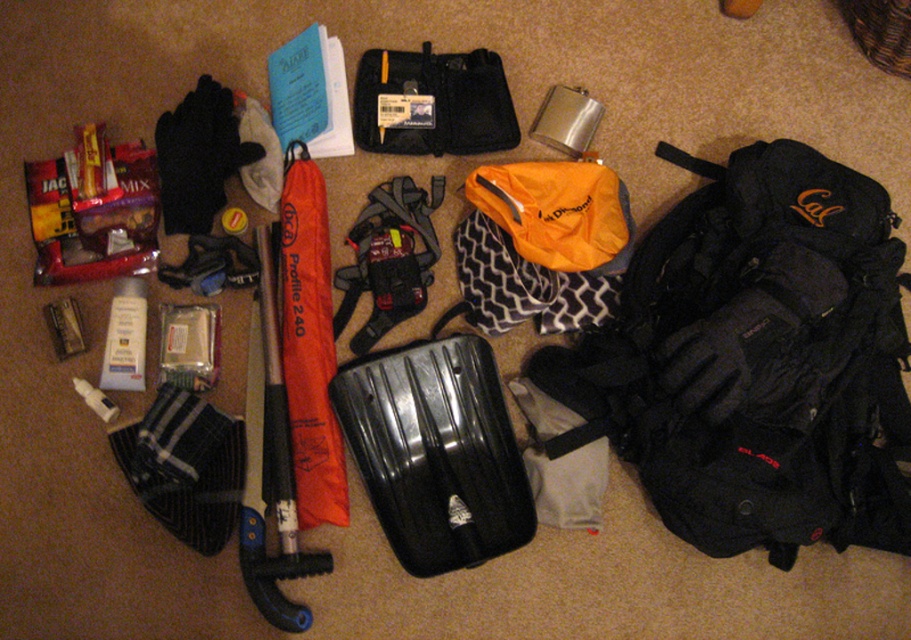
Question: Can you confirm if black hard shell suitcase at center is wider than orange fabric umbrella at center-left?

Choices:
 (A) no
 (B) yes

Answer: (B)

Question: Based on their relative distances, which object is nearer to the matte black backpack at right?

Choices:
 (A) orange fabric umbrella at center-left
 (B) black hard shell suitcase at center
 (C) black fabric case at center

Answer: (B)

Question: Is black hard shell suitcase at center thinner than black fabric case at center?

Choices:
 (A) no
 (B) yes

Answer: (A)

Question: Is black hard shell suitcase at center to the right of black fabric case at center from the viewer's perspective?

Choices:
 (A) yes
 (B) no

Answer: (A)

Question: Which point is farther to the camera?

Choices:
 (A) (427, 422)
 (B) (444, 67)
 (C) (563, 444)

Answer: (B)

Question: Among these objects, which one is nearest to the camera?

Choices:
 (A) orange fabric umbrella at center-left
 (B) black hard shell suitcase at center
 (C) matte black backpack at right
 (D) black fabric case at center

Answer: (C)